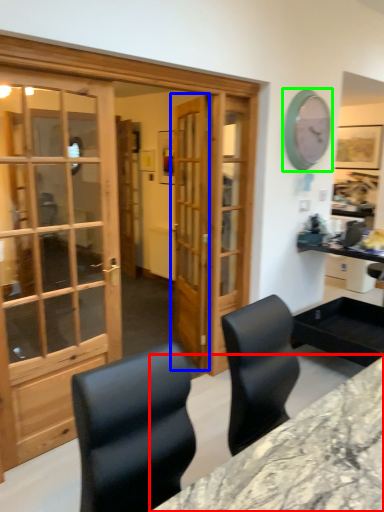
Question: Estimate the real-world distances between objects in this image. Which object is farther from desk (highlighted by a red box), door (highlighted by a blue box) or clock (highlighted by a green box)?

Choices:
 (A) door
 (B) clock

Answer: (B)